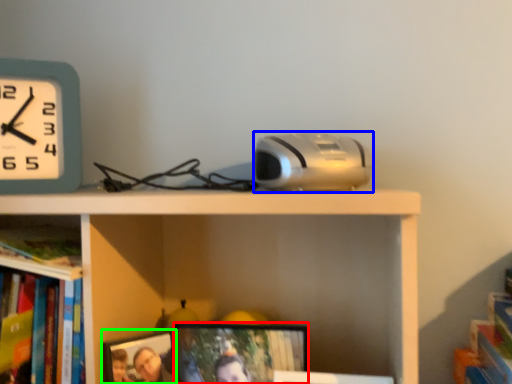
Question: Estimate the real-world distances between objects in this image. Which object is closer to picture frame (highlighted by a red box), gadget (highlighted by a blue box) or picture frame (highlighted by a green box)?

Choices:
 (A) gadget
 (B) picture frame

Answer: (B)